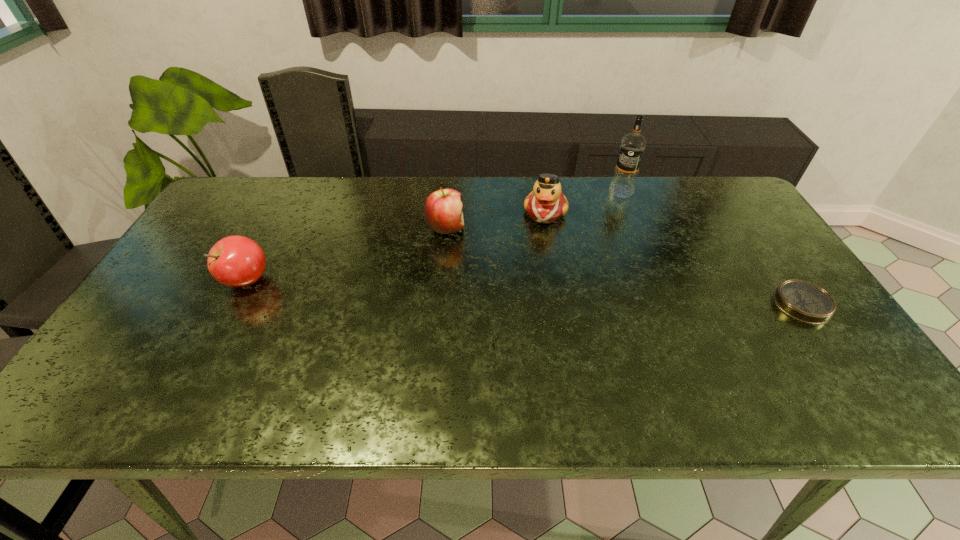
Where is `blank space located on the bitten side of the right apple`? Image resolution: width=960 pixels, height=540 pixels. blank space located on the bitten side of the right apple is located at coordinates (569, 295).

Where is `free space located 0.060m on the bitten side of the right apple`? free space located 0.060m on the bitten side of the right apple is located at coordinates (476, 245).

Find the location of a particular element. Image resolution: width=960 pixels, height=540 pixels. duck located at the far edge is located at coordinates (546, 203).

This screenshot has height=540, width=960. Find the location of `vodka positioned at the far edge`. vodka positioned at the far edge is located at coordinates (x=633, y=145).

At what (x,y) coordinates should I click in order to perform the action: click on apple located in the far edge section of the desktop. Please return your answer as a coordinate pair (x, y). The image size is (960, 540). Looking at the image, I should click on (443, 213).

Find the location of a particular element. This screenshot has width=960, height=540. object positioned at the left edge is located at coordinates (236, 261).

I want to click on object at the right edge, so point(804,301).

Find the location of `vacant space at the far edge of the desktop`. vacant space at the far edge of the desktop is located at coordinates (495, 180).

Locate an element on the screen. The width and height of the screenshot is (960, 540). free spot at the near edge of the desktop is located at coordinates (538, 374).

Locate an element on the screen. The width and height of the screenshot is (960, 540). blank space at the right edge is located at coordinates (749, 252).